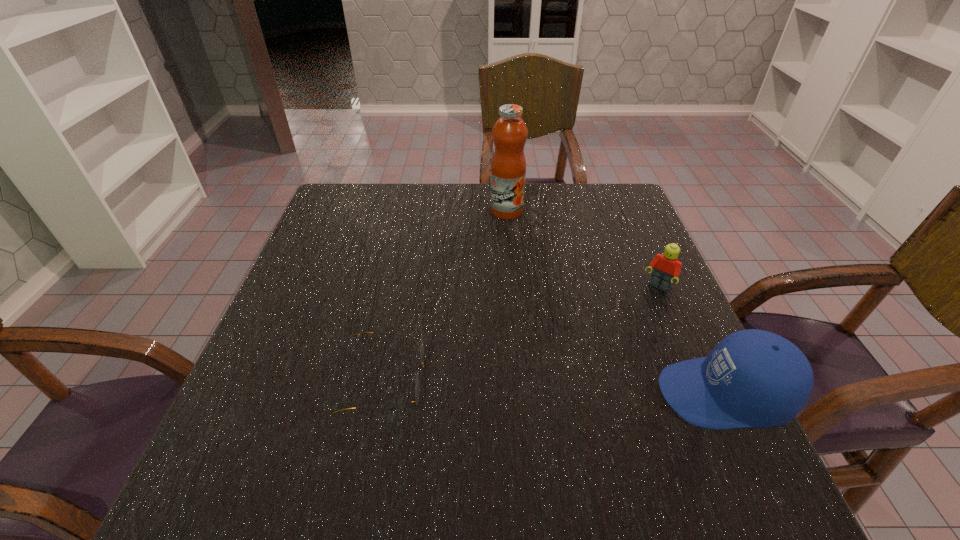
Identify the location of the second closest object to the cap. The height and width of the screenshot is (540, 960). (422, 348).

Where is `free location that satisfies the following two spatial constraints: 1. on the front side of the tallest object; 2. on the front-facing side of the cap`? free location that satisfies the following two spatial constraints: 1. on the front side of the tallest object; 2. on the front-facing side of the cap is located at coordinates (521, 394).

Where is `vacant space that satisfies the following two spatial constraints: 1. on the front side of the Lego; 2. on the front-facing side of the cap`? This screenshot has width=960, height=540. vacant space that satisfies the following two spatial constraints: 1. on the front side of the Lego; 2. on the front-facing side of the cap is located at coordinates (703, 394).

Where is `vacant region that satisfies the following two spatial constraints: 1. on the front side of the second farthest object; 2. on the left side of the farthest object`? The width and height of the screenshot is (960, 540). vacant region that satisfies the following two spatial constraints: 1. on the front side of the second farthest object; 2. on the left side of the farthest object is located at coordinates (513, 288).

Find the location of a particular element. The height and width of the screenshot is (540, 960). vacant area that satisfies the following two spatial constraints: 1. on the front side of the Lego; 2. on the right side of the farthest object is located at coordinates pos(513,288).